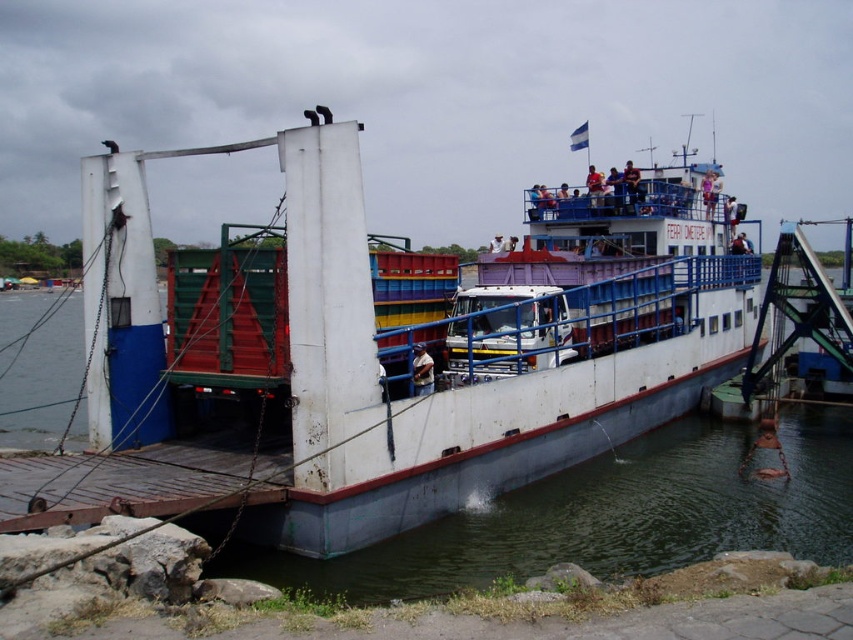
Is point (422, 376) closer to camera compared to point (705, 182)?

Yes.

In the scene shown: Who is more distant from viewer, (422, 362) or (712, 179)?

Point (712, 179)

This screenshot has width=853, height=640. Describe the element at coordinates (422, 371) in the screenshot. I see `light brown leather jacket at center` at that location.

This screenshot has width=853, height=640. In order to click on light brown leather jacket at center in this screenshot , I will do `click(422, 371)`.

Does point (490, 394) come in front of point (714, 193)?

Yes, point (490, 394) is in front of point (714, 193).

Between white matte boat at center and light blue fabric shirt at upper center, which one has more height?

With more height is white matte boat at center.

This screenshot has width=853, height=640. Identify the location of white matte boat at center. (386, 358).

Does point (434, 420) lie in front of point (424, 385)?

Yes, point (434, 420) is in front of point (424, 385).

Who is lower down, white matte boat at center or light brown leather jacket at center?

light brown leather jacket at center

Between point (335, 376) and point (426, 392), which one is positioned in front?

Point (335, 376) is more forward.

The image size is (853, 640). I want to click on white matte boat at center, so click(386, 358).